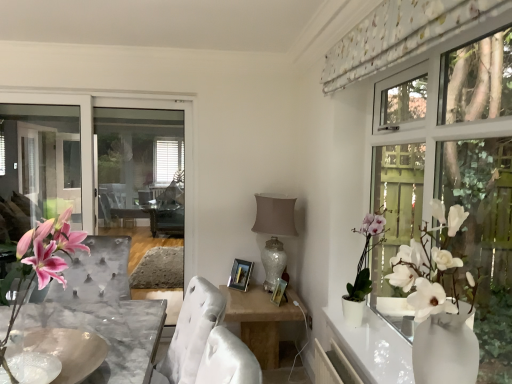
Where is `vacant point above clear glass window screen at left (from a real-world perspective)`? This screenshot has height=384, width=512. vacant point above clear glass window screen at left (from a real-world perspective) is located at coordinates (65, 89).